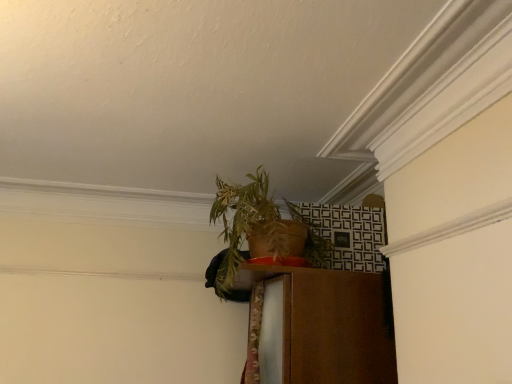
Describe the element at coordinates (243, 230) in the screenshot. The height and width of the screenshot is (384, 512). I see `green leafy plant at upper center` at that location.

This screenshot has height=384, width=512. I want to click on green leafy plant at upper center, so click(x=243, y=230).

Identify the location of green leafy plant at upper center. (243, 230).